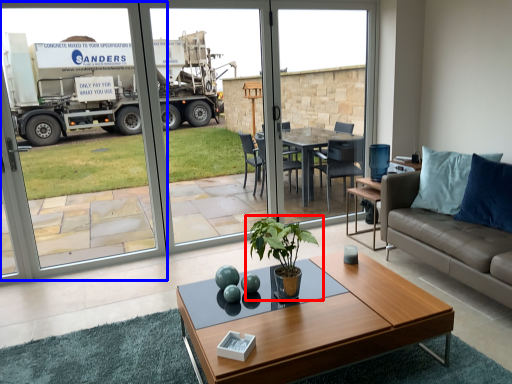
Question: Which point is further to the camera, houseplant (highlighted by a red box) or screen door (highlighted by a blue box)?

Choices:
 (A) houseplant
 (B) screen door

Answer: (B)